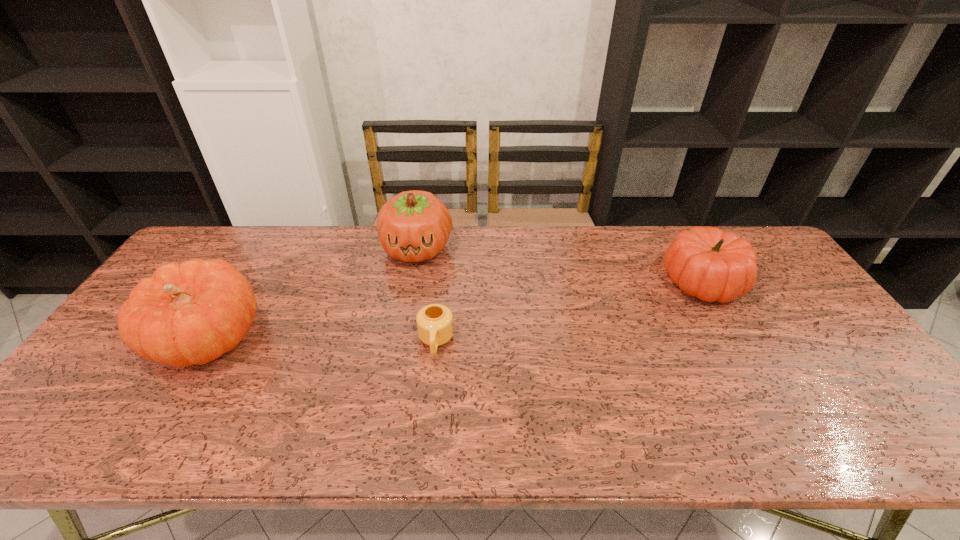
Find the location of a particular element. This screenshot has height=540, width=960. vacant space at the far edge of the desktop is located at coordinates (446, 251).

In the image, there is a desktop. Where is `free space at the near edge`? This screenshot has width=960, height=540. free space at the near edge is located at coordinates (386, 432).

Where is `free space at the left edge of the desktop`? free space at the left edge of the desktop is located at coordinates (152, 362).

Locate an element on the screen. The height and width of the screenshot is (540, 960). vacant region at the right edge is located at coordinates (859, 366).

In the image, there is a desktop. What are the coordinates of `vacant space at the far left corner` in the screenshot? It's located at (236, 237).

In the image, there is a desktop. Where is `vacant space at the far right corner`? This screenshot has height=540, width=960. vacant space at the far right corner is located at coordinates (758, 239).

Where is `free space between the second pumpkin from right to left and the leftmost object`? This screenshot has width=960, height=540. free space between the second pumpkin from right to left and the leftmost object is located at coordinates (312, 294).

Where is `unoccupied area between the leftmost pumpkin and the second pumpkin from right to left`? The height and width of the screenshot is (540, 960). unoccupied area between the leftmost pumpkin and the second pumpkin from right to left is located at coordinates (312, 294).

Find the location of a particular element. Image resolution: width=960 pixels, height=540 pixels. free space between the leftmost pumpkin and the second pumpkin from right to left is located at coordinates (312, 294).

Locate an element on the screen. free space between the third tallest object and the second pumpkin from right to left is located at coordinates (560, 265).